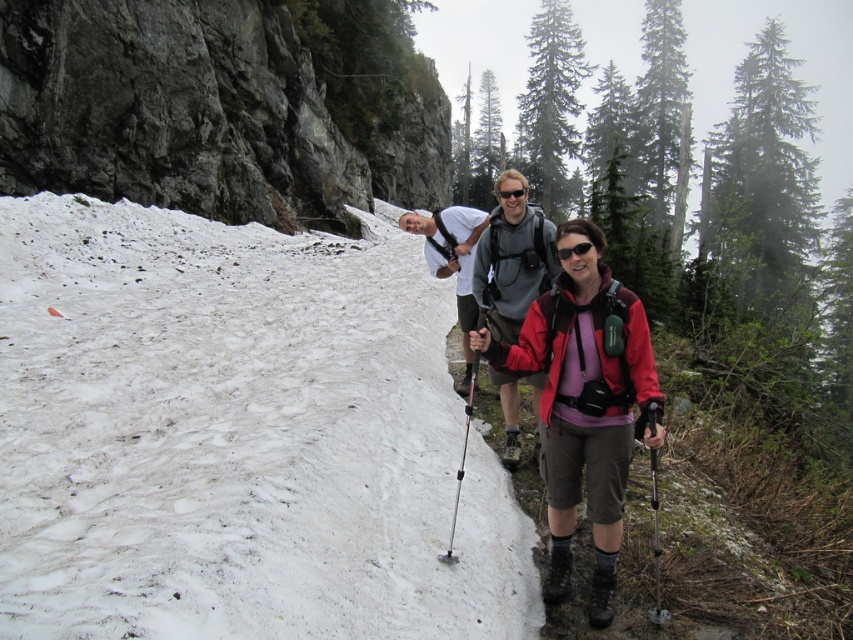
Is white powdery snow at center to the right of silver metallic ski pole at center from the viewer's perspective?

In fact, white powdery snow at center is to the left of silver metallic ski pole at center.

Based on the photo, who is lower down, white powdery snow at center or silver metallic ski pole at center?

silver metallic ski pole at center is below.

Locate an element on the screen. This screenshot has width=853, height=640. white powdery snow at center is located at coordinates (236, 436).

Looking at this image, between black rubber ski pole at center and silver metallic ski pole at center, which one has less height?

black rubber ski pole at center

From the picture: Does black rubber ski pole at center have a greater height compared to silver metallic ski pole at center?

In fact, black rubber ski pole at center may be shorter than silver metallic ski pole at center.

Where is `black rubber ski pole at center`? This screenshot has width=853, height=640. black rubber ski pole at center is located at coordinates (656, 544).

Between red fabric jacket at center and silver metallic ski pole at center, which one appears on the right side from the viewer's perspective?

red fabric jacket at center

I want to click on red fabric jacket at center, so click(x=572, y=380).